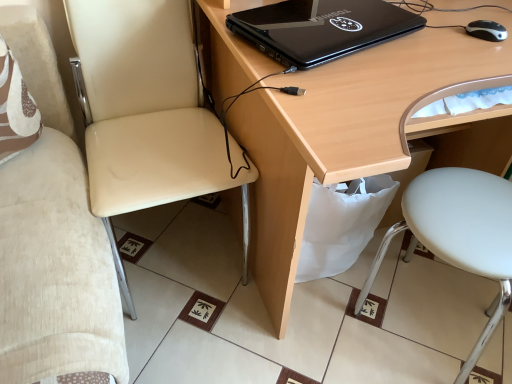
Question: Is light wood desk at center turned away from white matte stool at lower right, the 1th chair from the right?

Choices:
 (A) no
 (B) yes

Answer: (A)

Question: Does light wood desk at center have a larger size compared to white matte stool at lower right, which is the 2th chair from left to right?

Choices:
 (A) no
 (B) yes

Answer: (B)

Question: Does light wood desk at center appear on the left side of white matte stool at lower right, the 1th chair from the right?

Choices:
 (A) no
 (B) yes

Answer: (B)

Question: Can you confirm if light wood desk at center is smaller than white matte stool at lower right, the 1th chair from the right?

Choices:
 (A) no
 (B) yes

Answer: (A)

Question: Could white matte stool at lower right, which is the 2th chair from left to right, be considered to be inside light wood desk at center?

Choices:
 (A) no
 (B) yes

Answer: (B)

Question: Would you say light wood desk at center is to the left or to the right of black plastic mouse at right in the picture?

Choices:
 (A) left
 (B) right

Answer: (A)

Question: From a real-world perspective, is light wood desk at center physically located above or below black plastic mouse at right?

Choices:
 (A) below
 (B) above

Answer: (A)

Question: In the image, is light wood desk at center positioned in front of or behind black plastic mouse at right?

Choices:
 (A) front
 (B) behind

Answer: (A)

Question: From their relative heights in the image, would you say light wood desk at center is taller or shorter than black plastic mouse at right?

Choices:
 (A) short
 (B) tall

Answer: (B)

Question: Looking at the image, does black plastic mouse at right seem bigger or smaller compared to white matte stool at lower right, which is the 2th chair from left to right?

Choices:
 (A) small
 (B) big

Answer: (A)

Question: Is black plastic mouse at right taller or shorter than white matte stool at lower right, which is the 2th chair from left to right?

Choices:
 (A) short
 (B) tall

Answer: (A)

Question: Does point 486,24 appear closer or farther from the camera than point 496,213?

Choices:
 (A) closer
 (B) farther

Answer: (B)

Question: From the image's perspective, is black plastic mouse at right above or below white matte stool at lower right, which is the 2th chair from left to right?

Choices:
 (A) above
 (B) below

Answer: (A)

Question: Would you say light wood desk at center is inside or outside black matte laptop at upper center?

Choices:
 (A) inside
 (B) outside

Answer: (B)

Question: From the image's perspective, is light wood desk at center located above or below black matte laptop at upper center?

Choices:
 (A) above
 (B) below

Answer: (B)